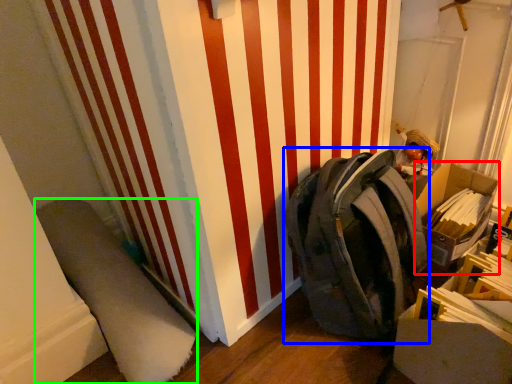
Question: Which object is positioned farthest from cardboard box (highlighted by a red box)? Select from backpack (highlighted by a blue box) and wide (highlighted by a green box).

Choices:
 (A) backpack
 (B) wide

Answer: (B)